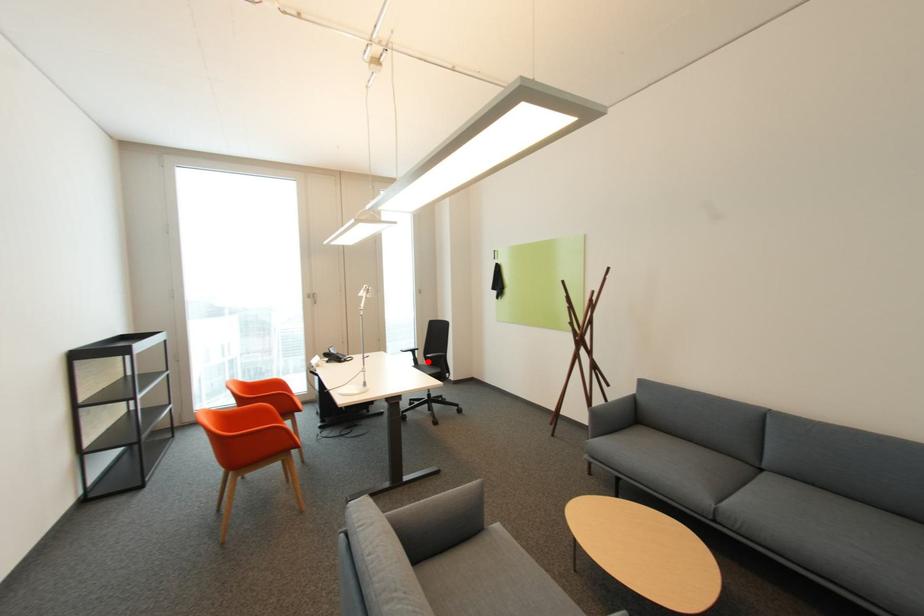
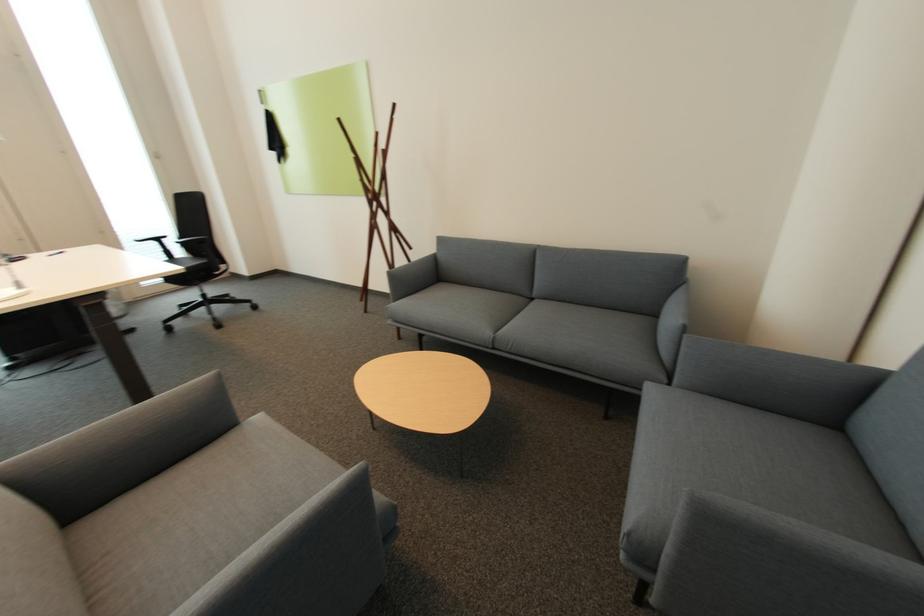
Question: A red point is marked in image1. In image2, is the corresponding 3D point closer to the camera or farther? Reply with the corresponding letter.

Choices:
 (A) The corresponding 3D point is closer.
 (B) The corresponding 3D point is farther.

Answer: (A)